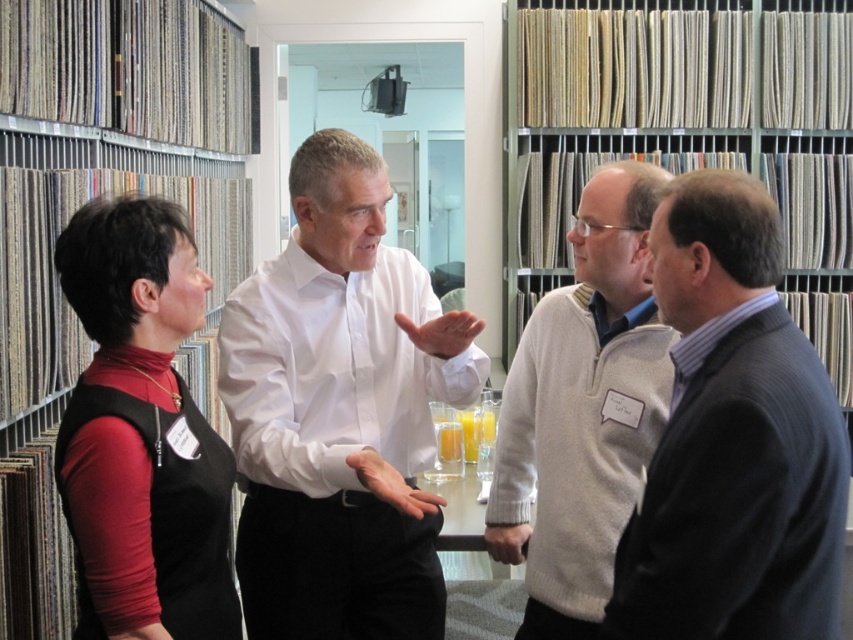
Does metallic gray bookshelf at left appear under white textured sweater at center?

Incorrect, metallic gray bookshelf at left is not positioned below white textured sweater at center.

Does point (15, 499) come in front of point (589, 246)?

No.

Where is `metallic gray bookshelf at left`? This screenshot has width=853, height=640. metallic gray bookshelf at left is located at coordinates point(65,225).

Does white smooth shirt at center have a lesser width compared to gray wool sweater at right?

No, white smooth shirt at center is not thinner than gray wool sweater at right.

Does point (259, 269) come farther from viewer compared to point (746, 406)?

Yes, it is.

Identify the location of white smooth shirt at center. The image size is (853, 640). (340, 412).

Is white smooth shirt at center bigger than white textured sweater at center?

Correct, white smooth shirt at center is larger in size than white textured sweater at center.

Does white smooth shirt at center appear on the left side of white textured sweater at center?

Correct, you'll find white smooth shirt at center to the left of white textured sweater at center.

Which is in front, point (305, 273) or point (514, 400)?

Point (305, 273) is more forward.

This screenshot has width=853, height=640. I want to click on white smooth shirt at center, so click(340, 412).